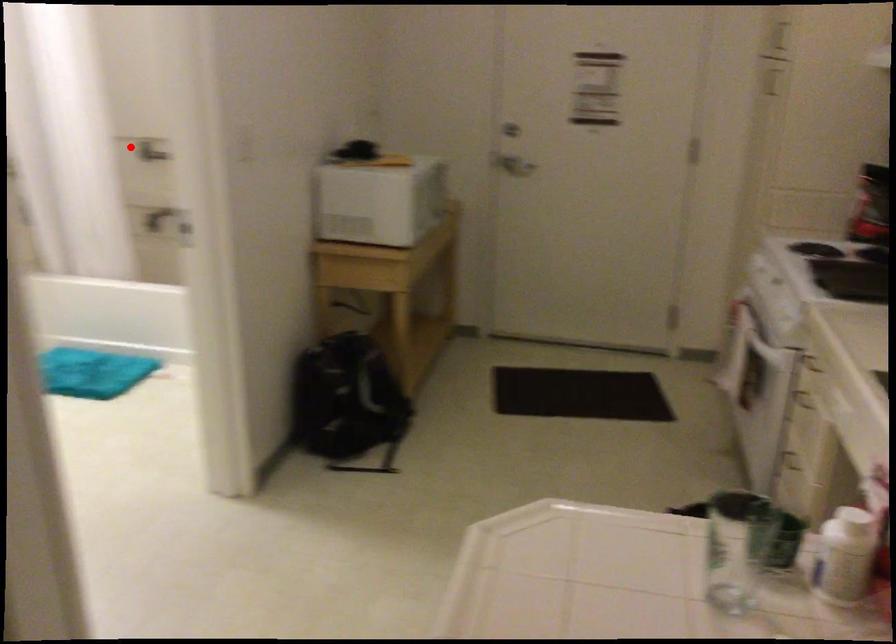
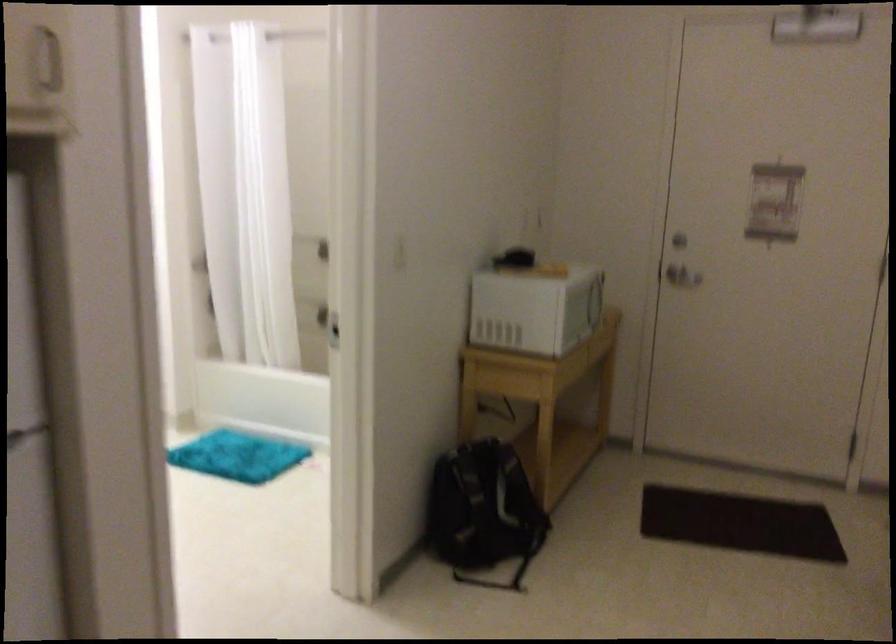
The point at the highlighted location is marked in the first image. Where is the corresponding point in the second image?

(309, 245)